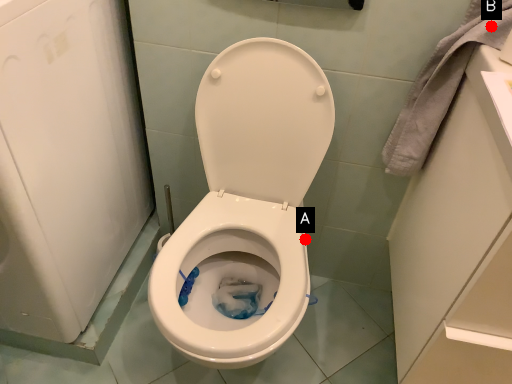
Question: Two points are circled on the image, labeled by A and B beside each circle. Among these points, which one is nearest to the camera?

Choices:
 (A) A is closer
 (B) B is closer

Answer: (B)